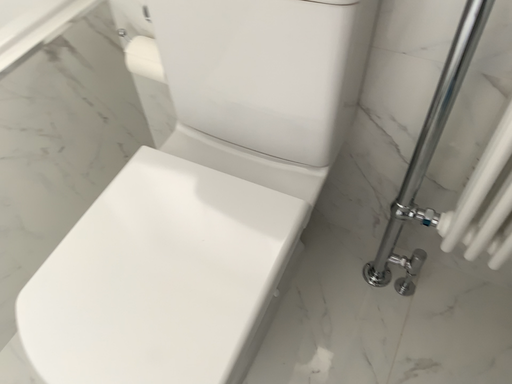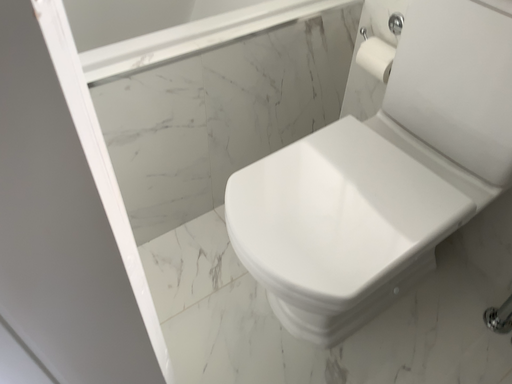
Question: How did the camera likely rotate when shooting the video?

Choices:
 (A) rotated left
 (B) rotated right

Answer: (A)